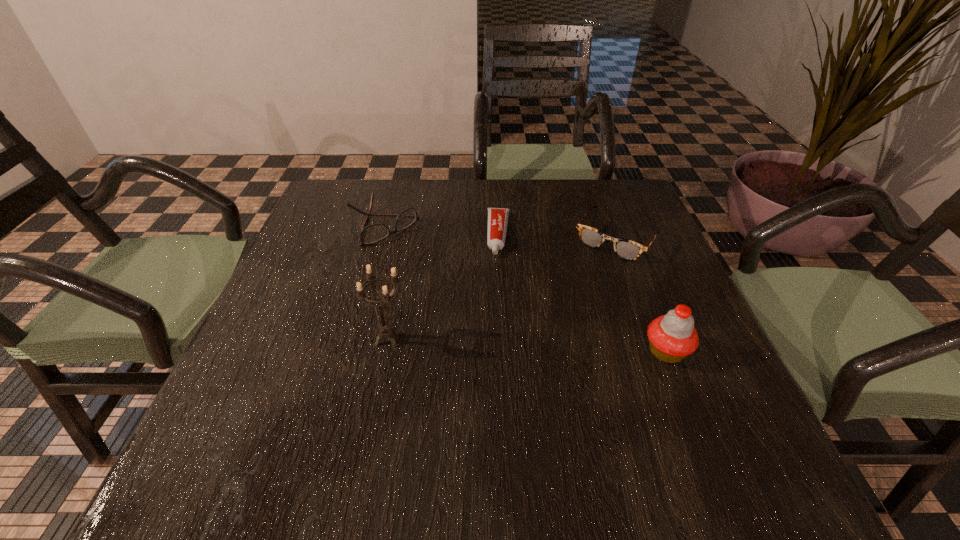
Identify the location of free space located 0.080m on the front-facing side of the left spectacles. (421, 258).

Image resolution: width=960 pixels, height=540 pixels. What are the coordinates of `free location located on the frame of the right spectacles` in the screenshot? It's located at (548, 335).

Where is `blank space located 0.290m on the frame of the right spectacles`? The width and height of the screenshot is (960, 540). blank space located 0.290m on the frame of the right spectacles is located at coordinates (545, 338).

The height and width of the screenshot is (540, 960). I want to click on vacant position located 0.220m on the frame of the right spectacles, so click(x=561, y=317).

At what (x,y) coordinates should I click in order to perform the action: click on vacant space situated 0.380m at the nozzle of the third object from right to left. Please return your answer as a coordinate pair (x, y). The width and height of the screenshot is (960, 540). Looking at the image, I should click on (491, 394).

You are a GUI agent. You are given a task and a screenshot of the screen. Output one action in this format:
    pyautogui.click(x=<x>, y=<y>)
    Task: Click on the vacant space located 0.110m at the nozzle of the third object from right to left
    
    Given the screenshot: What is the action you would take?
    pyautogui.click(x=497, y=290)

This screenshot has height=540, width=960. I want to click on free spot located at the nozzle of the third object from right to left, so click(496, 302).

Locate an element on the screen. This screenshot has width=960, height=540. toothpaste at the far edge is located at coordinates (497, 217).

Find the location of a particular element. object at the left edge is located at coordinates (373, 233).

Find the location of a particular element. cupcake positioned at the right edge is located at coordinates (672, 337).